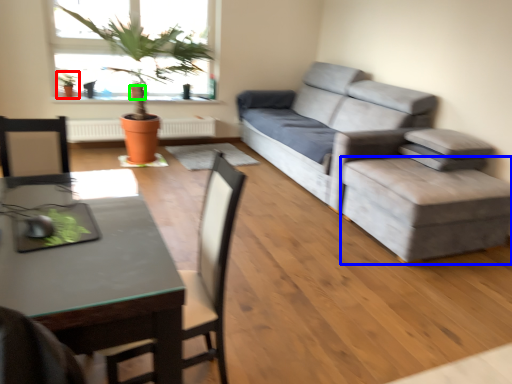
Question: Which object is positioned farthest from houseplant (highlighted by a red box)? Select from stool (highlighted by a blue box) and flowerpot (highlighted by a green box).

Choices:
 (A) stool
 (B) flowerpot

Answer: (A)